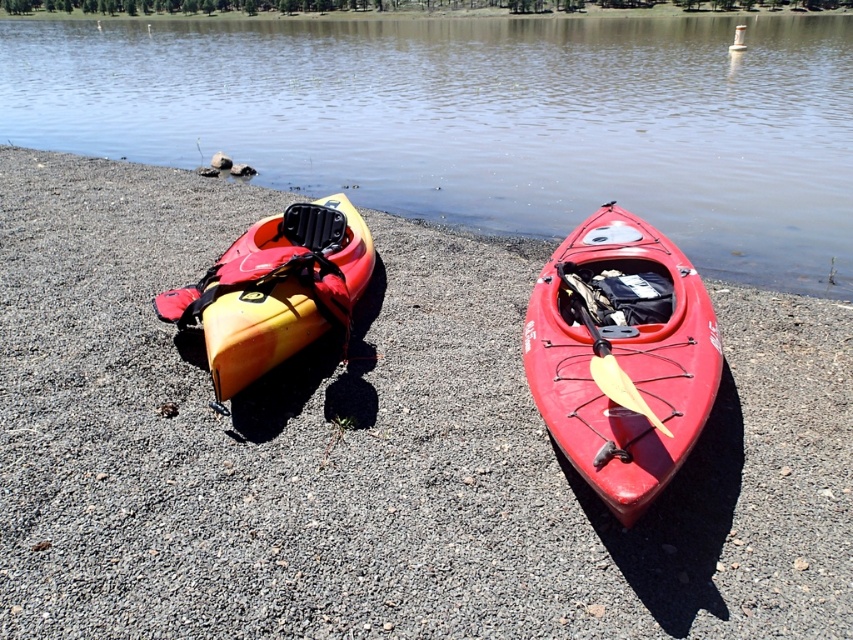
You are a photographer planning to capture a closeup of the matte red kayak at center and the yellow matte kayak at left. Since you want to focus on the red kayak, which one should you move closer to your camera?

The matte red kayak at center is positioned over the yellow matte kayak at left, so to focus on the red kayak, you should move closer to the matte red kayak at center.

You are standing at the point marked as point (482, 120) in the image. What is the nearest object to you?

The nearest object to you is transparent water at center located at point (482, 120).

Based on the photo, you are planning to cross the transparent water at center using the matte red kayak at center. Considering their sizes, will the kayak fit comfortably on the water without touching the edges?

The transparent water at center is wider than the matte red kayak at center, so the kayak will fit comfortably on the water without touching the edges.